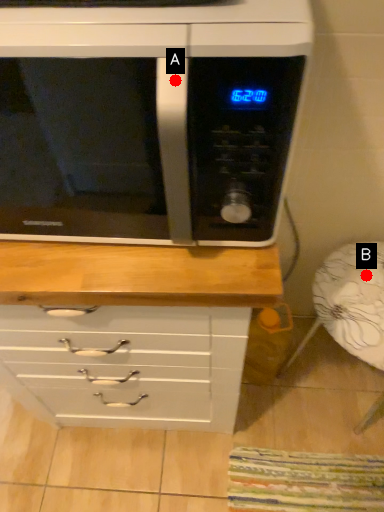
Question: Two points are circled on the image, labeled by A and B beside each circle. Among these points, which one is nearest to the camera?

Choices:
 (A) A is closer
 (B) B is closer

Answer: (A)